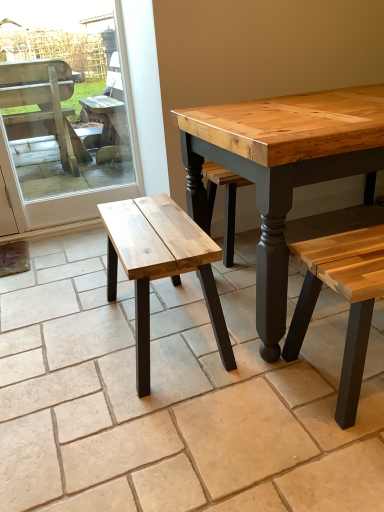
At what (x,y) coordinates should I click in order to perform the action: click on vacant area located to the right-hand side of natural wood bench at center. Please return your answer as a coordinate pair (x, y). The height and width of the screenshot is (512, 384). Looking at the image, I should click on (258, 334).